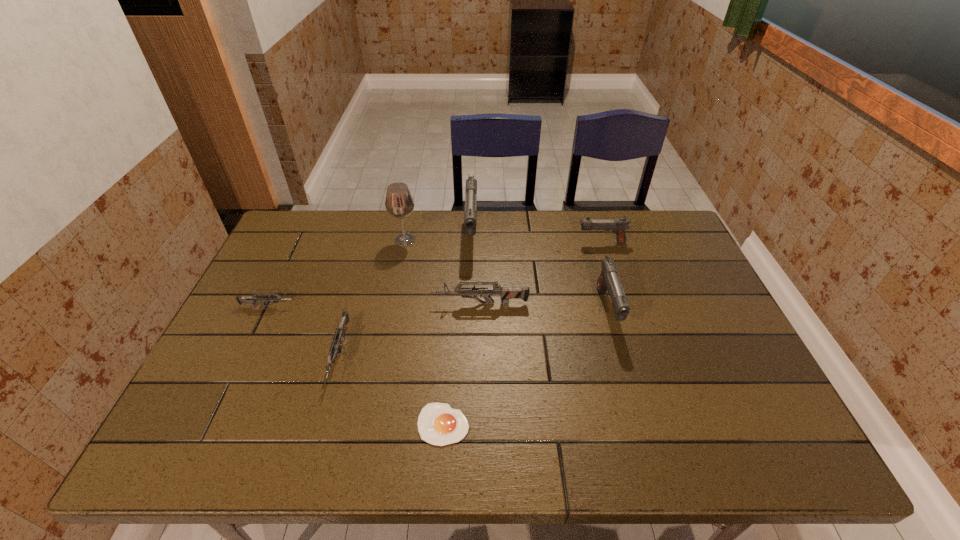
At what (x,y) coordinates should I click in order to perform the action: click on vacant space in between the nearest object and the second tallest gun. Please return your answer as a coordinate pair (x, y). Looking at the image, I should click on (525, 367).

The height and width of the screenshot is (540, 960). Identify the location of blank region between the smallest gray gun and the nearest object. (522, 333).

This screenshot has height=540, width=960. I want to click on unoccupied position between the egg yolk and the leftmost grey gun, so click(x=356, y=365).

Identify the location of free area in between the third tallest object and the nearest grey gun. (473, 333).

Identify the location of empty space between the fifth gun from right to left and the nearest object. (392, 390).

This screenshot has width=960, height=540. Find the location of `object identified as the sixth closest to the third object from left to right`. object identified as the sixth closest to the third object from left to right is located at coordinates pyautogui.click(x=608, y=280).

Where is `the fourth closest object to the egg yolk`? This screenshot has height=540, width=960. the fourth closest object to the egg yolk is located at coordinates (252, 299).

At what (x,y) coordinates should I click in order to perform the action: click on gun that is the third closest to the third object from left to right. Please return your answer as a coordinate pair (x, y). Image resolution: width=960 pixels, height=540 pixels. Looking at the image, I should click on (339, 334).

Select which gun is the closest to the fourth tallest gun. Please provide its 2D coordinates. Your answer should be formatted as a tuple, i.e. [(x, y)], where the tuple contains the x and y coordinates of a point satisfying the conditions above.

[(470, 214)]

Locate an element on the screen. This screenshot has height=540, width=960. gray gun that is the third closest one to the smallest grey gun is located at coordinates (619, 226).